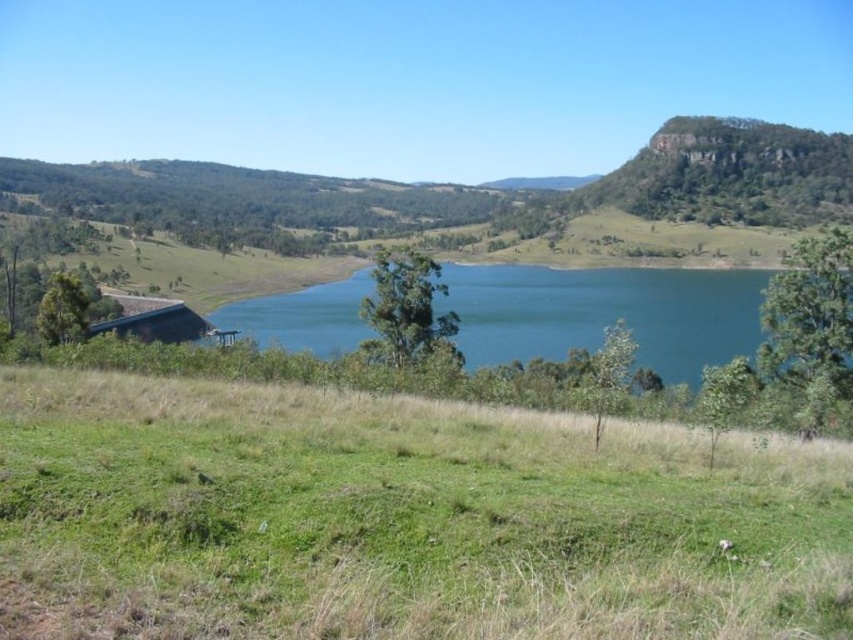
Is point (639, 321) farther from viewer compared to point (141, 333)?

Yes, point (639, 321) is farther from viewer.

In the scene shown: Is the position of blue water at center more distant than that of rustic wooden hut at lower left?

No, blue water at center is closer to the viewer.

Between point (606, 275) and point (148, 305), which one is positioned in front?

Point (148, 305)

Identify the location of blue water at center. This screenshot has height=640, width=853. (616, 314).

Which of these two, green grassy hillside at lower center or rustic wooden hut at lower left, stands taller?

rustic wooden hut at lower left

Is point (148, 467) behind point (170, 323)?

That is False.

Describe the element at coordinates (399, 518) in the screenshot. I see `green grassy hillside at lower center` at that location.

Image resolution: width=853 pixels, height=640 pixels. I want to click on green grassy hillside at lower center, so 399,518.

Can you confirm if green grassy hillside at lower center is wider than blue water at center?

No.

Looking at this image, is green grassy hillside at lower center positioned before blue water at center?

Yes, it is.

Where is `green grassy hillside at lower center`? green grassy hillside at lower center is located at coordinates (399, 518).